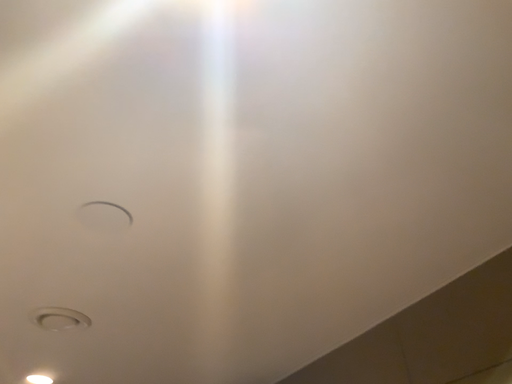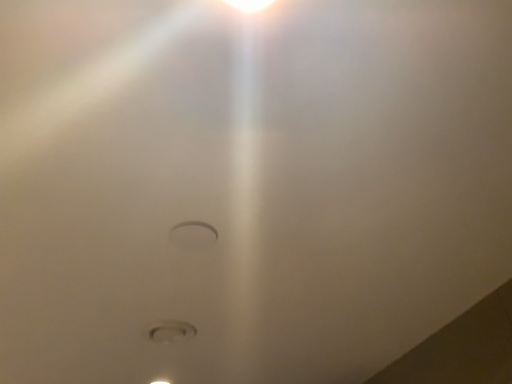
Question: Which way did the camera rotate in the video?

Choices:
 (A) rotated right
 (B) rotated left

Answer: (B)